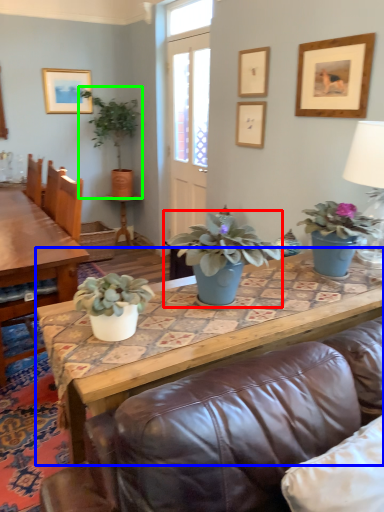
Question: Which is farther away from houseplant (highlighted by a red box)? coffee table (highlighted by a blue box) or houseplant (highlighted by a green box)?

Choices:
 (A) coffee table
 (B) houseplant

Answer: (B)